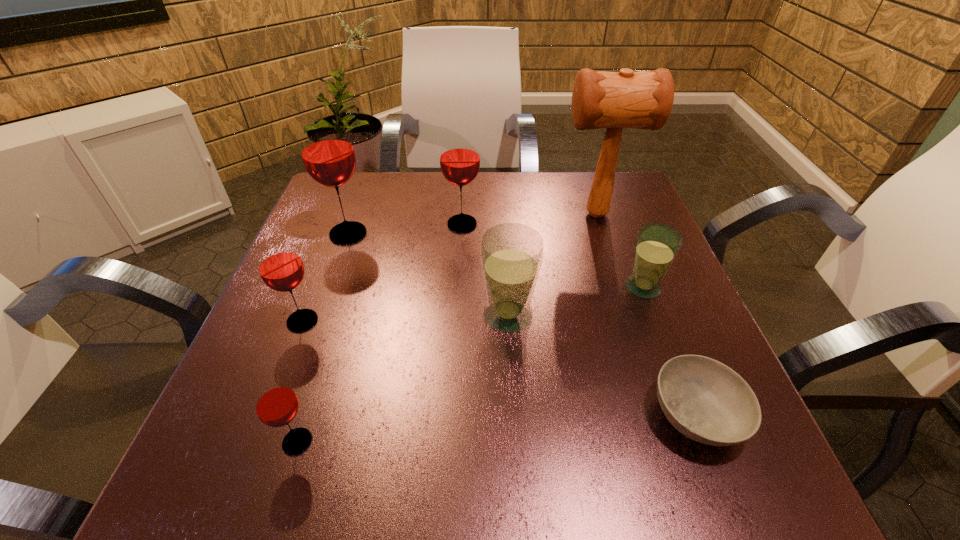
I want to click on free point between the second tallest object and the third tallest object, so click(x=405, y=229).

Locate an element on the screen. vacant space that is in between the bowl and the bigger blue glass is located at coordinates (602, 365).

Identify the location of unoccupied position between the bowl and the mallet. The image size is (960, 540). (646, 315).

You are a GUI agent. You are given a task and a screenshot of the screen. Output one action in this format:
    pyautogui.click(x=<x>, y=<y>)
    Task: Click on the unoccupied area between the second nearest red glass and the seventh shortest object
    Image resolution: width=960 pixels, height=540 pixels.
    Given the screenshot: What is the action you would take?
    pyautogui.click(x=325, y=278)

Locate an element on the screen. The width and height of the screenshot is (960, 540). free area in between the mallet and the rightmost glass is located at coordinates (619, 251).

Identify the location of vacant space in between the rightmost glass and the second nearest red glass. (472, 304).

Where is `free space between the tallest object and the bigger blue glass`? This screenshot has height=540, width=960. free space between the tallest object and the bigger blue glass is located at coordinates (552, 265).

This screenshot has height=540, width=960. I want to click on object identified as the seventh closest to the third biggest red glass, so click(x=657, y=245).

Locate which object ranks second in proximity to the biggest red glass. Please provide its 2D coordinates. Your answer should be formatted as a tuple, i.e. [(x, y)], where the tuple contains the x and y coordinates of a point satisfying the conditions above.

[(279, 264)]

This screenshot has width=960, height=540. What are the coordinates of `the fifth closest glass to the tallest object` in the screenshot? It's located at 279,264.